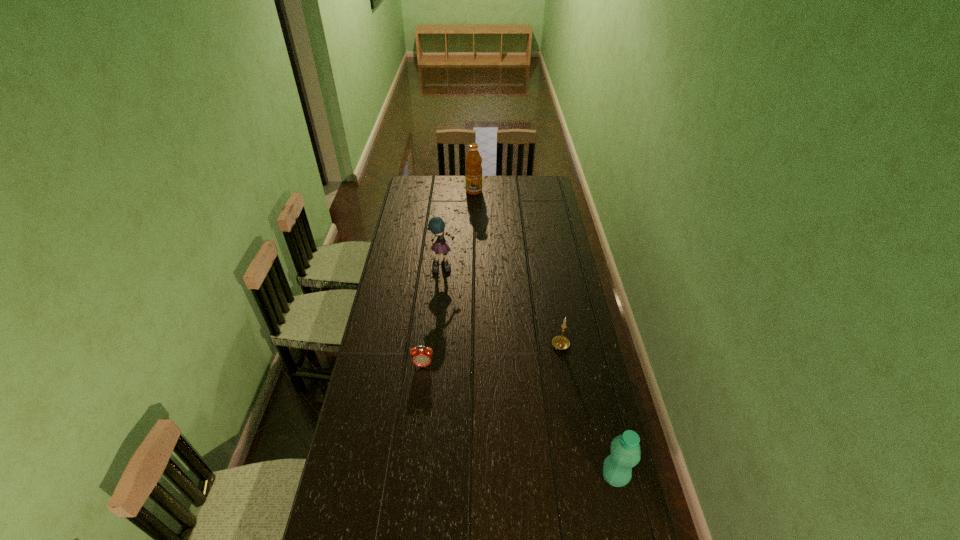
The height and width of the screenshot is (540, 960). In order to click on vacant space on the desktop that is between the shortest object and the third shortest object and is positioned on the front-facing side of the rag doll in this screenshot , I will do `click(510, 415)`.

Find the location of a particular element. The image size is (960, 540). vacant space on the desktop that is between the alarm clock and the nearest object and is positioned on the label side of the fruit juice is located at coordinates (529, 427).

Where is `free space on the desktop that is between the alarm clock and the bottle and is positioned on the handle side of the fourth tallest object`? Image resolution: width=960 pixels, height=540 pixels. free space on the desktop that is between the alarm clock and the bottle and is positioned on the handle side of the fourth tallest object is located at coordinates (512, 416).